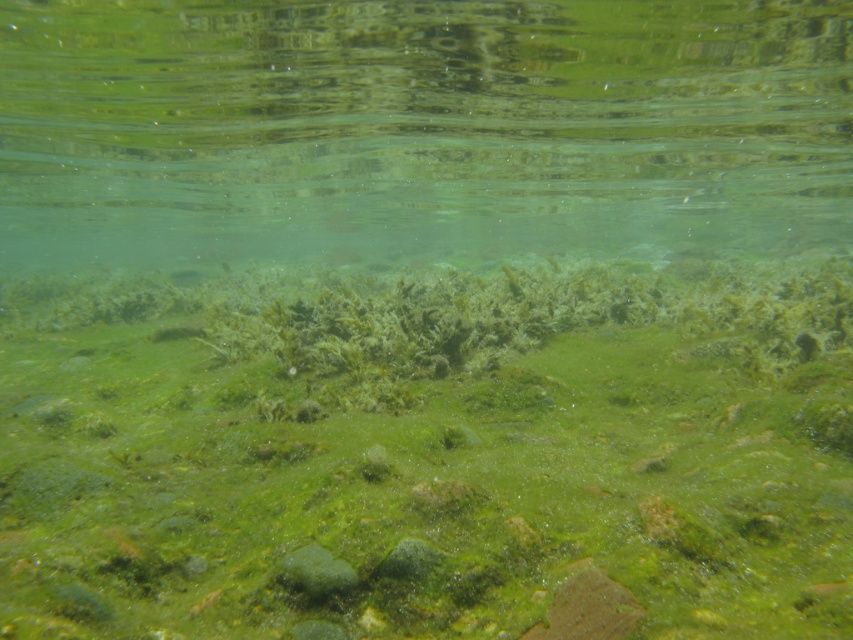
Can you confirm if green algae at center is shorter than green translucent water at center?

Yes, green algae at center is shorter than green translucent water at center.

Who is more forward, (486,486) or (659,150)?

Point (486,486)

Image resolution: width=853 pixels, height=640 pixels. I want to click on green algae at center, so click(427, 451).